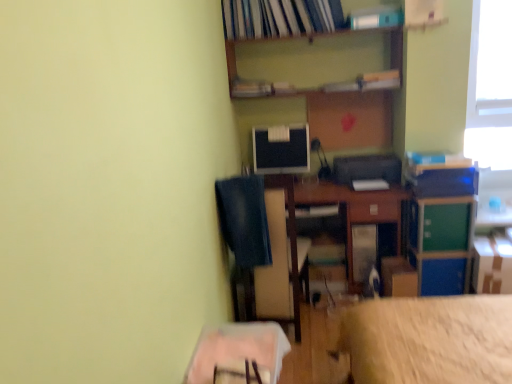
Question: Is white plastic book at upper center, marked as the second book in a top-to-bottom arrangement, wider or thinner than cardboard box at lower right, positioned as the 2th cardboard box in left-to-right order?

Choices:
 (A) thin
 (B) wide

Answer: (A)

Question: From their relative heights in the image, would you say white plastic book at upper center, which appears as the second book when ordered from the bottom, is taller or shorter than cardboard box at lower right, placed as the 1th cardboard box when sorted from right to left?

Choices:
 (A) tall
 (B) short

Answer: (B)

Question: Which object is positioned closest to the denim at left?

Choices:
 (A) wooden table at lower center, which is the second table in back-to-front order
 (B) cardboard box at lower right, placed as the 1th cardboard box when sorted from right to left
 (C) white plastic book at upper center, marked as the second book in a top-to-bottom arrangement
 (D) cardboard box at lower right, which is counted as the 1th cardboard box, starting from the left
 (E) wooden at upper center

Answer: (A)

Question: Which of these objects is positioned farthest from the wooden table at lower center, arranged as the first table when viewed from the front?

Choices:
 (A) green plastic file cabinet at right
 (B) wooden at upper center
 (C) matte plastic book at upper center, the first book when ordered from bottom to top
 (D) cardboard box at lower right, positioned as the 2th cardboard box in left-to-right order
 (E) hardcover book at upper center, arranged as the first book when viewed from the top

Answer: (E)